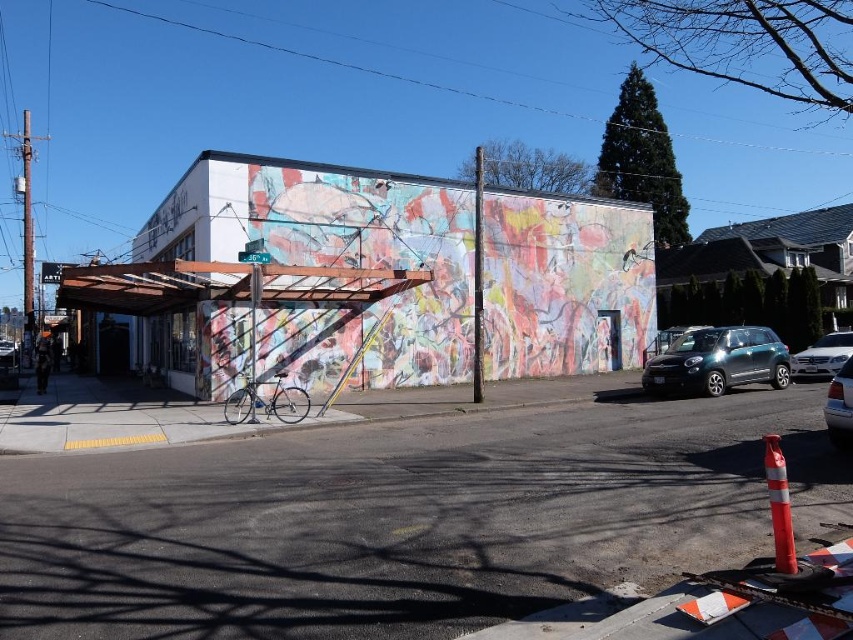
Does point (764, 333) come in front of point (793, 360)?

That is True.

Is point (659, 384) positioned after point (788, 362)?

No, (659, 384) is in front of (788, 362).

Image resolution: width=853 pixels, height=640 pixels. Identify the location of shiny dark gray car at right. (718, 362).

Who is shorter, shiny dark gray car at right or metallic silver sedan at right?

Standing shorter between the two is metallic silver sedan at right.

Is point (701, 378) more distant than point (840, 422)?

Yes, it is behind point (840, 422).

Find the location of a particular element. shiny dark gray car at right is located at coordinates (718, 362).

Can you confirm if satin silver sedan at right is positioned below metallic silver sedan at right?

No.

Is point (838, 337) in front of point (845, 440)?

No, (838, 337) is further to viewer.

Is point (833, 353) more distant than point (840, 412)?

Yes, it is.

You are a GUI agent. You are given a task and a screenshot of the screen. Output one action in this format:
    pyautogui.click(x=<x>, y=<y>)
    Task: Click on the satin silver sedan at right
    Image resolution: width=853 pixels, height=640 pixels.
    Given the screenshot: What is the action you would take?
    pyautogui.click(x=822, y=355)